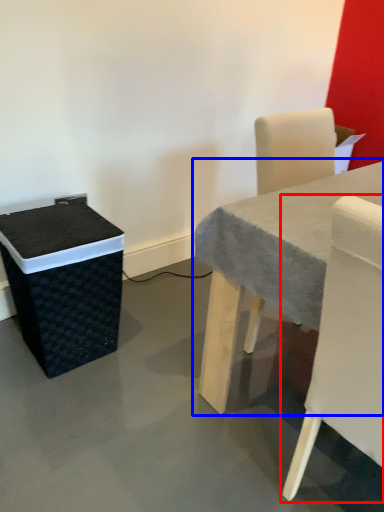
Question: Which of the following is the farthest to the observer, chair (highlighted by a red box) or table (highlighted by a blue box)?

Choices:
 (A) chair
 (B) table

Answer: (B)